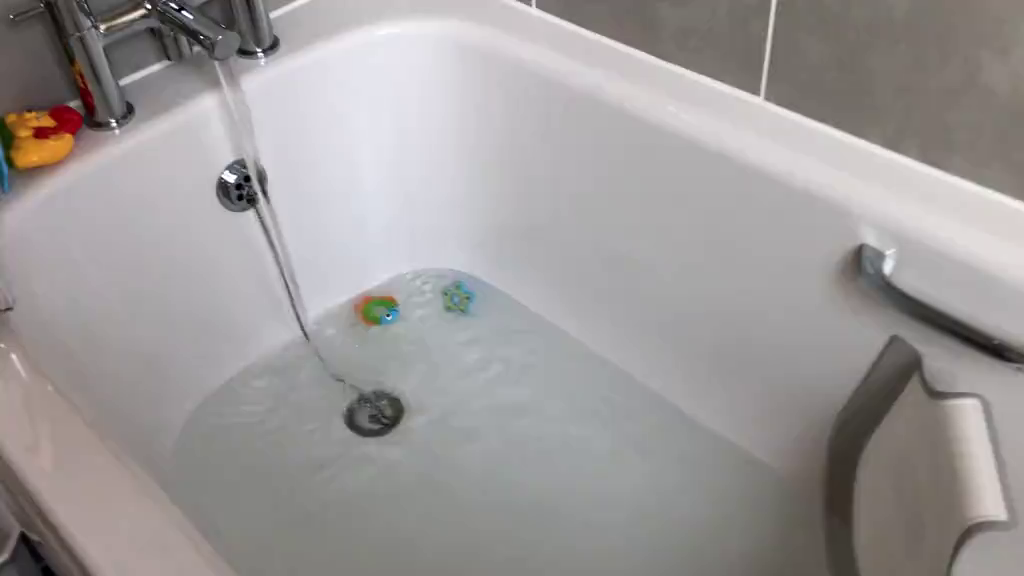
Identify the location of space to the right of the bath fixtures. Image resolution: width=1024 pixels, height=576 pixels. (329, 14).